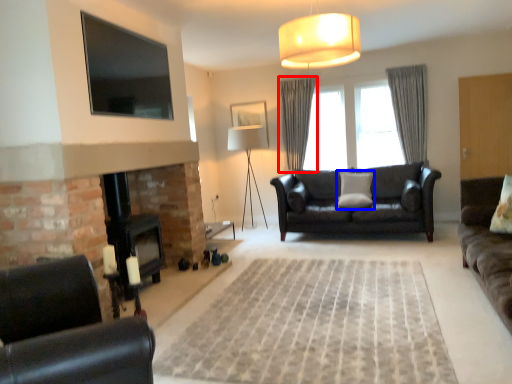
Question: Among these objects, which one is farthest to the camera, curtain (highlighted by a red box) or pillow (highlighted by a blue box)?

Choices:
 (A) curtain
 (B) pillow

Answer: (A)